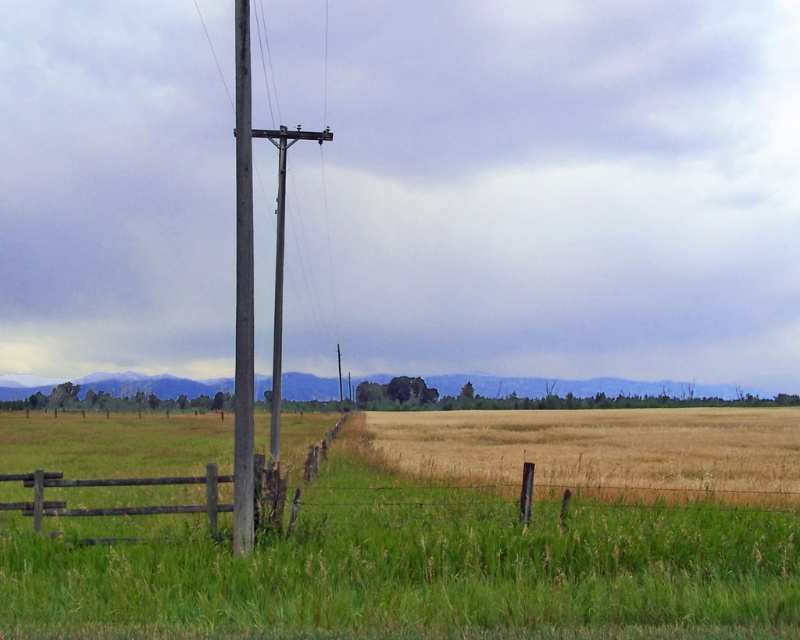
You are standing in the rural landscape and want to cross the field to reach the wooden telegraph pole at left. However, there is a brown wooden fence at lower left in your way. Can you walk around the fence to get to the pole without crossing it?

The brown wooden fence at lower left is closer to the viewer than the wooden telegraph pole at left, so you can walk around the fence to reach the pole without crossing it.